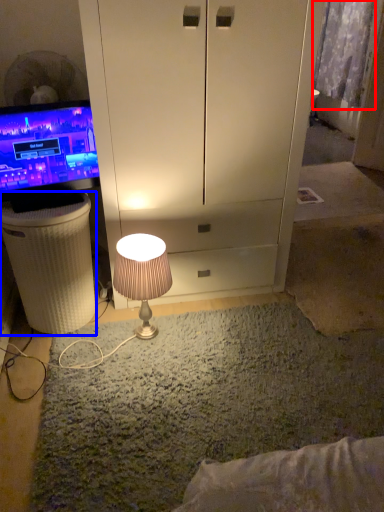
Question: Which object is closer to the camera taking this photo, curtain (highlighted by a red box) or vanity (highlighted by a blue box)?

Choices:
 (A) curtain
 (B) vanity

Answer: (B)